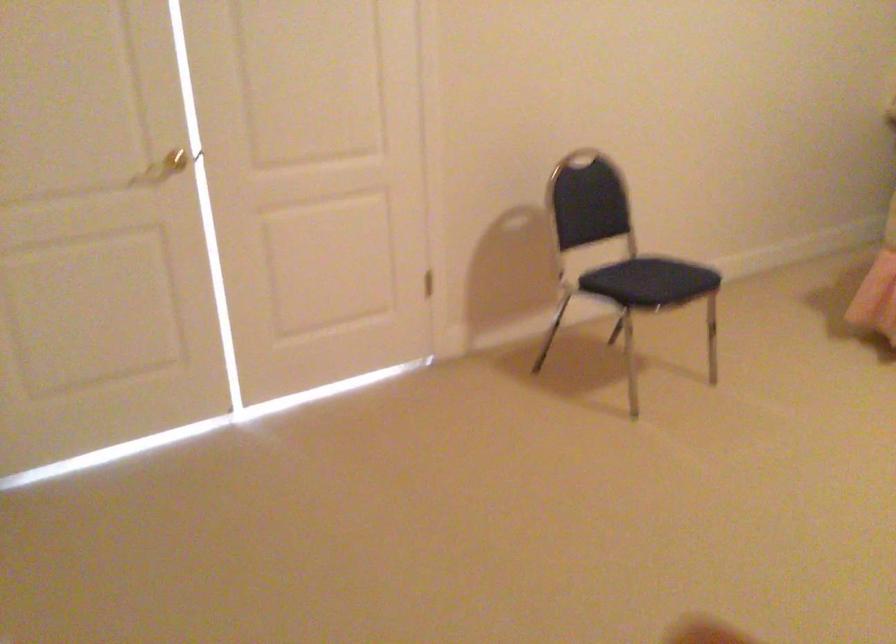
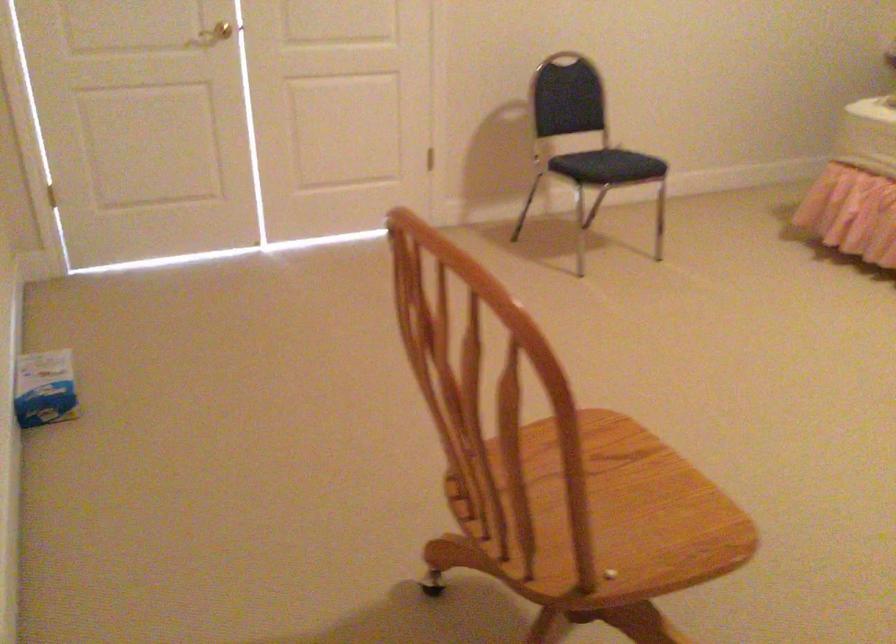
Locate, in the second image, the point that corresponds to pixel 157 171 in the first image.

(214, 33)